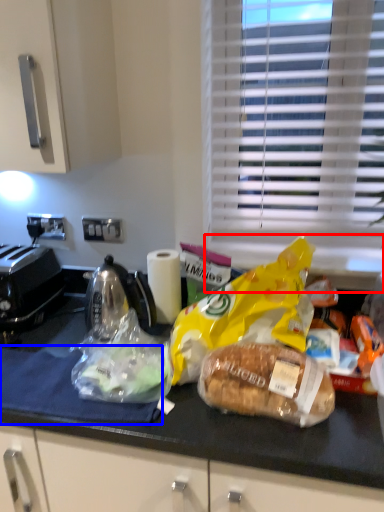
Question: Which object is further to the camera taking this photo, window sill (highlighted by a red box) or cloth (highlighted by a blue box)?

Choices:
 (A) window sill
 (B) cloth

Answer: (A)